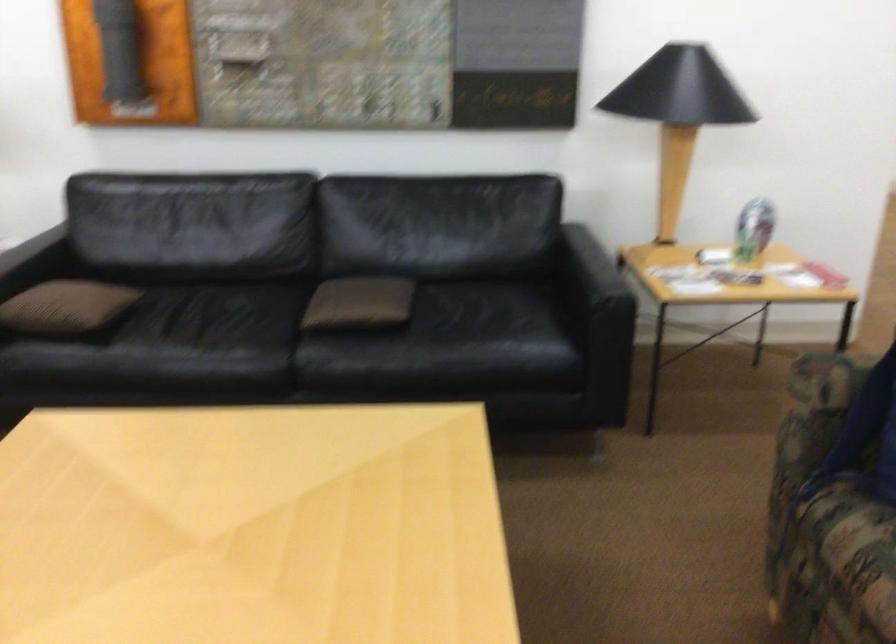
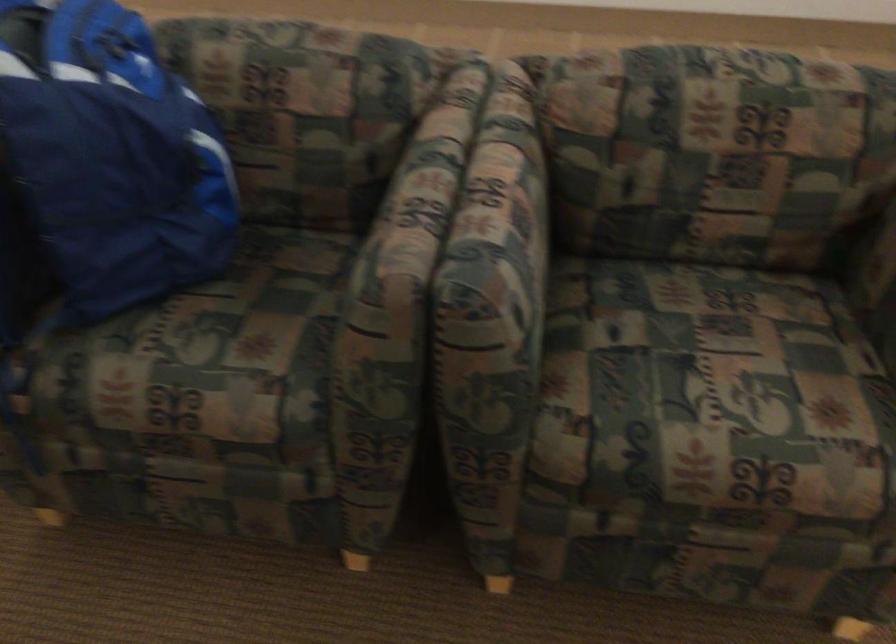
How did the camera likely rotate?

The rotation direction of the camera is right-down.